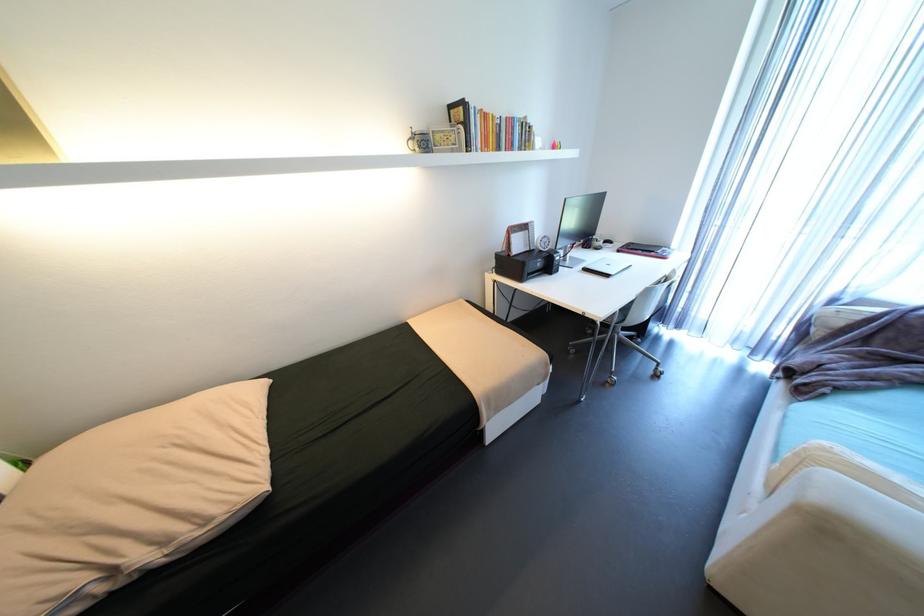
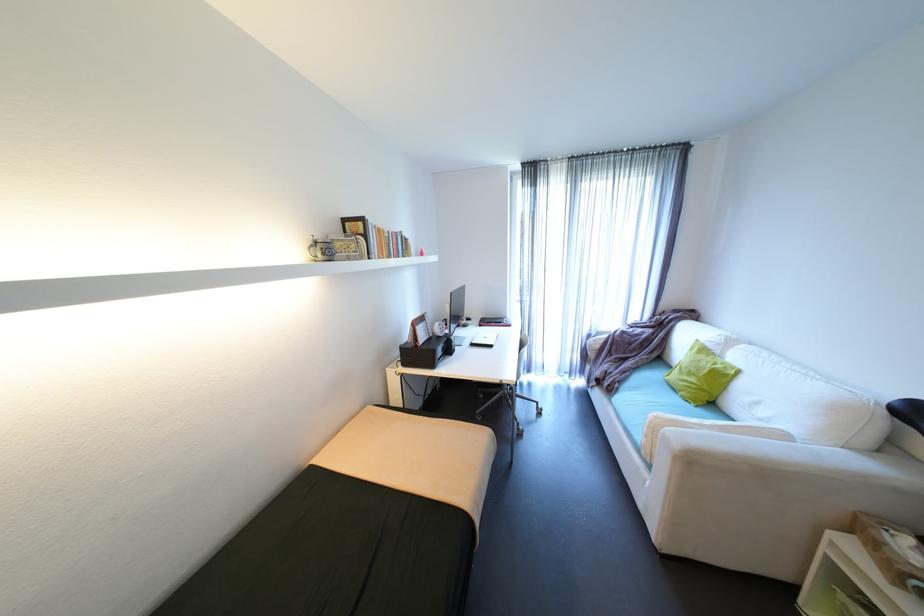
In the second image, find the point that corresponds to pixel 480 148 in the first image.

(380, 254)